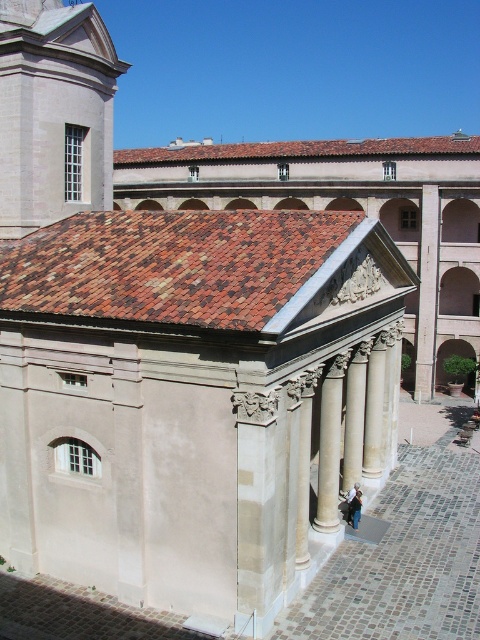
You are an architect examining the classical structure. You notice the smooth stone column at right and the white marble pillar at center. Which one appears closer to you in the image?

The smooth stone column at right appears closer to you than the white marble pillar at center because it is further to the viewer.

You are an architect evaluating the structural integrity of the classical building. Considering the smooth stone tower at upper left and the white marble column at center, which object would you prioritize inspecting for potential stability issues based on their sizes?

The white marble column at center should be prioritized for inspection because it is larger than the smooth stone tower at upper left, making it potentially more critical to the overall structure.